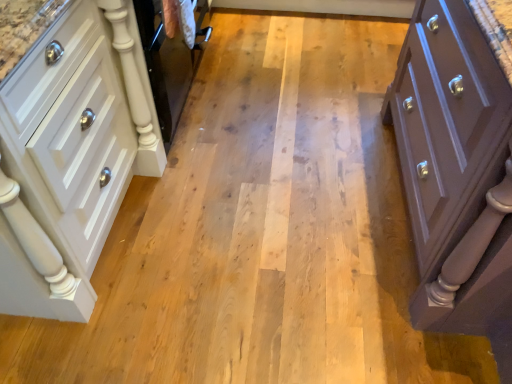
The width and height of the screenshot is (512, 384). Describe the element at coordinates (454, 167) in the screenshot. I see `matte purple chest of drawers at right, marked as the 2th chest of drawers in a left-to-right arrangement` at that location.

In order to face matte purple chest of drawers at right, marked as the 2th chest of drawers in a left-to-right arrangement, should I rotate leftwards or rightwards?

Turn right by 33.233 degrees to look at matte purple chest of drawers at right, marked as the 2th chest of drawers in a left-to-right arrangement.

Find the location of a particular element. This screenshot has height=384, width=512. matte purple chest of drawers at right, marked as the 2th chest of drawers in a left-to-right arrangement is located at coordinates (454, 167).

What do you see at coordinates (70, 155) in the screenshot? I see `white glossy cabinet at left, which is the 1th chest of drawers in left-to-right order` at bounding box center [70, 155].

Identify the location of white glossy cabinet at left, which is the 1th chest of drawers in left-to-right order. The width and height of the screenshot is (512, 384). point(70,155).

Identify the location of matte purple chest of drawers at right, which ranks as the first chest of drawers in right-to-left order. (454, 167).

In the image, is matte purple chest of drawers at right, which ranks as the first chest of drawers in right-to-left order, on the left side or the right side of white glossy cabinet at left, which is the 1th chest of drawers in left-to-right order?

From the image, it's evident that matte purple chest of drawers at right, which ranks as the first chest of drawers in right-to-left order, is to the right of white glossy cabinet at left, which is the 1th chest of drawers in left-to-right order.

Is matte purple chest of drawers at right, which ranks as the first chest of drawers in right-to-left order, further to the viewer compared to white glossy cabinet at left, which is the 1th chest of drawers in left-to-right order?

No, matte purple chest of drawers at right, which ranks as the first chest of drawers in right-to-left order, is in front of white glossy cabinet at left, which is the 1th chest of drawers in left-to-right order.

Is point (456, 308) more distant than point (13, 214)?

Yes, point (456, 308) is farther from viewer.

From the image's perspective, is matte purple chest of drawers at right, marked as the 2th chest of drawers in a left-to-right arrangement, beneath white glossy cabinet at left, the 2th chest of drawers when ordered from right to left?

Indeed, from the image's perspective, matte purple chest of drawers at right, marked as the 2th chest of drawers in a left-to-right arrangement, is shown beneath white glossy cabinet at left, the 2th chest of drawers when ordered from right to left.

In the scene shown: From a real-world perspective, between matte purple chest of drawers at right, which ranks as the first chest of drawers in right-to-left order, and white glossy cabinet at left, which is the 1th chest of drawers in left-to-right order, who is vertically lower?

white glossy cabinet at left, which is the 1th chest of drawers in left-to-right order, is physically lower.

Which object is thinner, matte purple chest of drawers at right, marked as the 2th chest of drawers in a left-to-right arrangement, or white glossy cabinet at left, the 2th chest of drawers when ordered from right to left?

With smaller width is white glossy cabinet at left, the 2th chest of drawers when ordered from right to left.

From their relative heights in the image, would you say matte purple chest of drawers at right, which ranks as the first chest of drawers in right-to-left order, is taller or shorter than white glossy cabinet at left, which is the 1th chest of drawers in left-to-right order?

Clearly, matte purple chest of drawers at right, which ranks as the first chest of drawers in right-to-left order, is taller compared to white glossy cabinet at left, which is the 1th chest of drawers in left-to-right order.

Can you confirm if matte purple chest of drawers at right, marked as the 2th chest of drawers in a left-to-right arrangement, is smaller than white glossy cabinet at left, which is the 1th chest of drawers in left-to-right order?

No.

Is matte purple chest of drawers at right, marked as the 2th chest of drawers in a left-to-right arrangement, not within white glossy cabinet at left, the 2th chest of drawers when ordered from right to left?

Yes, matte purple chest of drawers at right, marked as the 2th chest of drawers in a left-to-right arrangement, is outside of white glossy cabinet at left, the 2th chest of drawers when ordered from right to left.

Consider the image. Is matte purple chest of drawers at right, marked as the 2th chest of drawers in a left-to-right arrangement, far away from white glossy cabinet at left, the 2th chest of drawers when ordered from right to left?

matte purple chest of drawers at right, marked as the 2th chest of drawers in a left-to-right arrangement, is positioned a significant distance from white glossy cabinet at left, the 2th chest of drawers when ordered from right to left.

Is white glossy cabinet at left, which is the 1th chest of drawers in left-to-right order, at the back of matte purple chest of drawers at right, which ranks as the first chest of drawers in right-to-left order?

No, matte purple chest of drawers at right, which ranks as the first chest of drawers in right-to-left order, is not facing away from white glossy cabinet at left, which is the 1th chest of drawers in left-to-right order.

What's the angular difference between matte purple chest of drawers at right, which ranks as the first chest of drawers in right-to-left order, and white glossy cabinet at left, which is the 1th chest of drawers in left-to-right order,'s facing directions?

The angle between the facing direction of matte purple chest of drawers at right, which ranks as the first chest of drawers in right-to-left order, and the facing direction of white glossy cabinet at left, which is the 1th chest of drawers in left-to-right order, is 179 degrees.

Identify the location of chest of drawers that appears on the left of matte purple chest of drawers at right, marked as the 2th chest of drawers in a left-to-right arrangement. (70, 155).

Is white glossy cabinet at left, the 2th chest of drawers when ordered from right to left, to the left or to the right of matte purple chest of drawers at right, which ranks as the first chest of drawers in right-to-left order, in the image?

From the image, it's evident that white glossy cabinet at left, the 2th chest of drawers when ordered from right to left, is to the left of matte purple chest of drawers at right, which ranks as the first chest of drawers in right-to-left order.

Considering their positions, is white glossy cabinet at left, which is the 1th chest of drawers in left-to-right order, located in front of or behind matte purple chest of drawers at right, marked as the 2th chest of drawers in a left-to-right arrangement?

In the image, white glossy cabinet at left, which is the 1th chest of drawers in left-to-right order, appears behind matte purple chest of drawers at right, marked as the 2th chest of drawers in a left-to-right arrangement.

Does point (79, 127) appear closer or farther from the camera than point (495, 275)?

Point (79, 127).

From the image's perspective, is white glossy cabinet at left, which is the 1th chest of drawers in left-to-right order, over matte purple chest of drawers at right, marked as the 2th chest of drawers in a left-to-right arrangement?

Yes, from the image's perspective, white glossy cabinet at left, which is the 1th chest of drawers in left-to-right order, is above matte purple chest of drawers at right, marked as the 2th chest of drawers in a left-to-right arrangement.

From a real-world perspective, does white glossy cabinet at left, which is the 1th chest of drawers in left-to-right order, sit lower than matte purple chest of drawers at right, marked as the 2th chest of drawers in a left-to-right arrangement?

Indeed, from a real-world perspective, white glossy cabinet at left, which is the 1th chest of drawers in left-to-right order, is positioned beneath matte purple chest of drawers at right, marked as the 2th chest of drawers in a left-to-right arrangement.

Does white glossy cabinet at left, the 2th chest of drawers when ordered from right to left, have a lesser width compared to matte purple chest of drawers at right, marked as the 2th chest of drawers in a left-to-right arrangement?

Indeed, white glossy cabinet at left, the 2th chest of drawers when ordered from right to left, has a lesser width compared to matte purple chest of drawers at right, marked as the 2th chest of drawers in a left-to-right arrangement.

Is white glossy cabinet at left, the 2th chest of drawers when ordered from right to left, taller or shorter than matte purple chest of drawers at right, marked as the 2th chest of drawers in a left-to-right arrangement?

Clearly, white glossy cabinet at left, the 2th chest of drawers when ordered from right to left, is shorter compared to matte purple chest of drawers at right, marked as the 2th chest of drawers in a left-to-right arrangement.

Based on their sizes in the image, would you say white glossy cabinet at left, which is the 1th chest of drawers in left-to-right order, is bigger or smaller than matte purple chest of drawers at right, which ranks as the first chest of drawers in right-to-left order?

white glossy cabinet at left, which is the 1th chest of drawers in left-to-right order, is smaller than matte purple chest of drawers at right, which ranks as the first chest of drawers in right-to-left order.

Is white glossy cabinet at left, which is the 1th chest of drawers in left-to-right order, situated inside matte purple chest of drawers at right, marked as the 2th chest of drawers in a left-to-right arrangement, or outside?

The correct answer is: outside.

Is white glossy cabinet at left, which is the 1th chest of drawers in left-to-right order, far from matte purple chest of drawers at right, marked as the 2th chest of drawers in a left-to-right arrangement?

white glossy cabinet at left, which is the 1th chest of drawers in left-to-right order, is far away from matte purple chest of drawers at right, marked as the 2th chest of drawers in a left-to-right arrangement.

Does white glossy cabinet at left, the 2th chest of drawers when ordered from right to left, turn towards matte purple chest of drawers at right, marked as the 2th chest of drawers in a left-to-right arrangement?

Yes, white glossy cabinet at left, the 2th chest of drawers when ordered from right to left, faces towards matte purple chest of drawers at right, marked as the 2th chest of drawers in a left-to-right arrangement.

Consider the image. Can you tell me how much white glossy cabinet at left, which is the 1th chest of drawers in left-to-right order, and matte purple chest of drawers at right, which ranks as the first chest of drawers in right-to-left order, differ in facing direction?

There is a 179-degree angle between the facing directions of white glossy cabinet at left, which is the 1th chest of drawers in left-to-right order, and matte purple chest of drawers at right, which ranks as the first chest of drawers in right-to-left order.

Locate an element on the screen. The width and height of the screenshot is (512, 384). chest of drawers below the white glossy cabinet at left, the 2th chest of drawers when ordered from right to left (from the image's perspective) is located at coordinates (454, 167).

Where is `the chest of drawers located behind the matte purple chest of drawers at right, which ranks as the first chest of drawers in right-to-left order`? Image resolution: width=512 pixels, height=384 pixels. the chest of drawers located behind the matte purple chest of drawers at right, which ranks as the first chest of drawers in right-to-left order is located at coordinates (70, 155).

At what (x,y) coordinates should I click in order to perform the action: click on chest of drawers above the matte purple chest of drawers at right, marked as the 2th chest of drawers in a left-to-right arrangement (from the image's perspective). Please return your answer as a coordinate pair (x, y). Looking at the image, I should click on (70, 155).